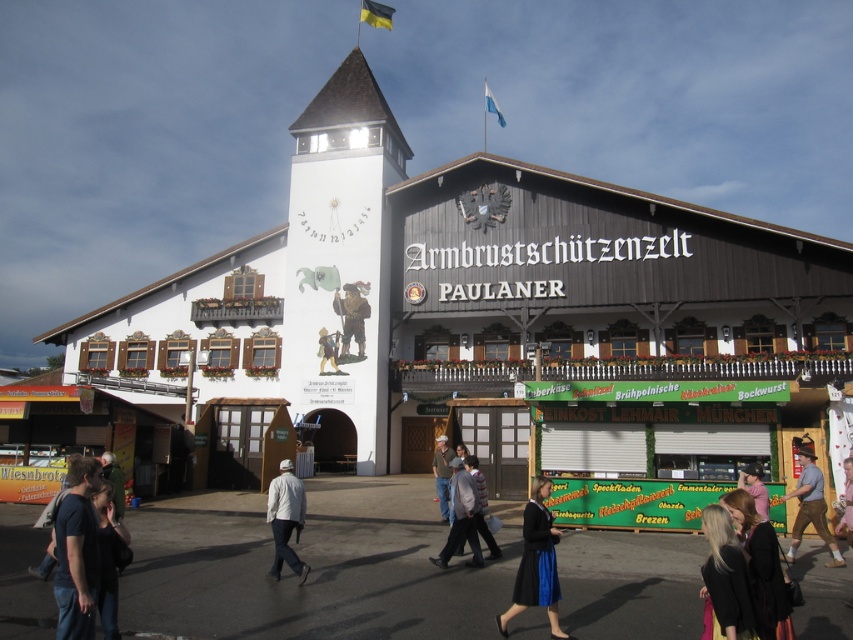
Does black fabric hair at lower right appear on the right side of denim jacket at center?

Yes, black fabric hair at lower right is to the right of denim jacket at center.

Does black fabric hair at lower right have a greater width compared to denim jacket at center?

Yes, black fabric hair at lower right is wider than denim jacket at center.

Find the location of a particular element. Image resolution: width=853 pixels, height=640 pixels. black fabric hair at lower right is located at coordinates (724, 579).

Does black fabric hair at lower right have a greater height compared to black fabric dress at lower right?

Yes.

Is point (712, 563) in front of point (780, 576)?

Yes.

The height and width of the screenshot is (640, 853). Describe the element at coordinates (724, 579) in the screenshot. I see `black fabric hair at lower right` at that location.

The image size is (853, 640). I want to click on black fabric hair at lower right, so click(x=724, y=579).

Can you confirm if black fabric dress at lower right is smaller than pink fabric at center?

Indeed, black fabric dress at lower right has a smaller size compared to pink fabric at center.

Does point (753, 541) come closer to viewer compared to point (747, 468)?

Yes, point (753, 541) is closer to viewer.

At what (x,y) coordinates should I click in order to perform the action: click on black fabric dress at lower right. Please return your answer as a coordinate pair (x, y). The height and width of the screenshot is (640, 853). Looking at the image, I should click on (761, 566).